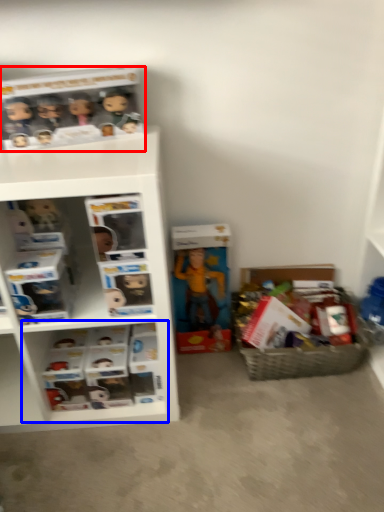
Question: Which of the following is the farthest to the observer, collection (highlighted by a red box) or cabinet (highlighted by a blue box)?

Choices:
 (A) collection
 (B) cabinet

Answer: (B)